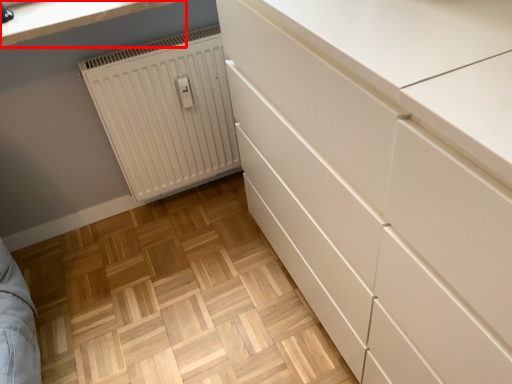
Question: In this image, where is countertop (annotated by the red box) located relative to radiator?

Choices:
 (A) right
 (B) left

Answer: (B)